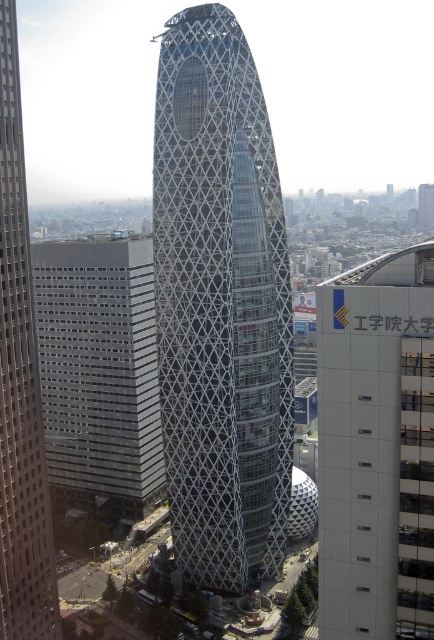
Question: Which of the following is the closest to the observer?

Choices:
 (A) gray glass building at left
 (B) white concrete building at right
 (C) gray glass skyscraper at center
 (D) metallic lattice tower at center

Answer: (B)

Question: Is white concrete building at right behind gray glass building at left?

Choices:
 (A) yes
 (B) no

Answer: (B)

Question: Can you confirm if white concrete building at right is positioned below gray glass building at left?

Choices:
 (A) no
 (B) yes

Answer: (A)

Question: Estimate the real-world distances between objects in this image. Which object is closer to the gray glass skyscraper at center?

Choices:
 (A) gray glass building at left
 (B) white concrete building at right
 (C) metallic lattice tower at center

Answer: (C)

Question: Which point appears farthest from the camera in this image?

Choices:
 (A) (411, 288)
 (B) (105, 387)
 (C) (2, 3)
 (D) (243, 435)

Answer: (B)

Question: Can you confirm if gray glass building at left is positioned above gray glass skyscraper at center?

Choices:
 (A) yes
 (B) no

Answer: (B)